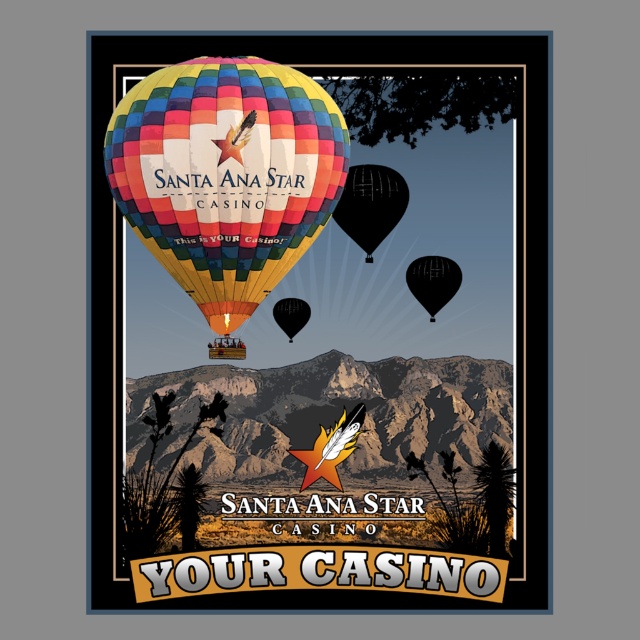
Does multicolored fabric hot air balloon at upper center have a lesser width compared to multicolored fabric hot air balloon at center?

No.

Which is in front, point (205, 595) or point (150, 134)?

Point (150, 134) is in front.

The width and height of the screenshot is (640, 640). Identify the location of multicolored fabric hot air balloon at upper center. (316, 323).

Can you confirm if rugged stone mountain at center is positioned below black glossy balloon at center?

Correct, rugged stone mountain at center is located below black glossy balloon at center.

Does point (227, 432) lie behind point (289, 298)?

Yes.

Find the location of a particular element. rugged stone mountain at center is located at coordinates 324,416.

Which is more to the left, multicolored fabric hot air balloon at upper center or black matte balloon at upper right?

multicolored fabric hot air balloon at upper center

Is point (189, 157) positioned behind point (438, 262)?

No, it is in front of (438, 262).

Does point (218, 378) come closer to viewer compared to point (422, 288)?

That is False.

Locate an element on the screen. The height and width of the screenshot is (640, 640). multicolored fabric hot air balloon at upper center is located at coordinates (316, 323).